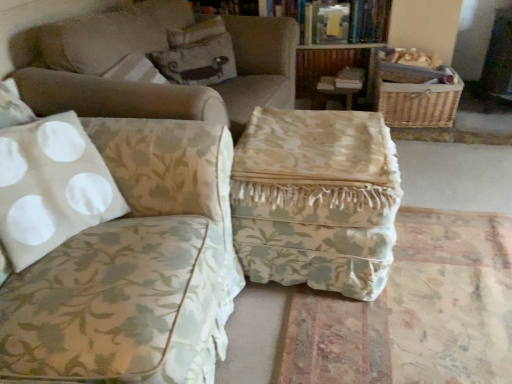
Question: Are floral fabric ottoman at center, which is the first studio couch from back to front, and floral fabric ottoman at center beside each other?

Choices:
 (A) no
 (B) yes

Answer: (A)

Question: Does floral fabric ottoman at center, which is counted as the second studio couch, starting from the front, have a larger size compared to floral fabric ottoman at center?

Choices:
 (A) no
 (B) yes

Answer: (B)

Question: Is floral fabric ottoman at center, which is counted as the second studio couch, starting from the front, looking in the opposite direction of floral fabric ottoman at center?

Choices:
 (A) no
 (B) yes

Answer: (A)

Question: Does floral fabric ottoman at center, which is the first studio couch from back to front, contain floral fabric ottoman at center?

Choices:
 (A) yes
 (B) no

Answer: (B)

Question: Does floral fabric ottoman at center, which is counted as the second studio couch, starting from the front, have a smaller size compared to floral fabric ottoman at center?

Choices:
 (A) yes
 (B) no

Answer: (B)

Question: From the image's perspective, relative to floral fabric pillow at upper center, is woven brown basket at upper right above or below?

Choices:
 (A) below
 (B) above

Answer: (A)

Question: From a real-world perspective, is woven brown basket at upper right physically located above or below floral fabric pillow at upper center?

Choices:
 (A) above
 (B) below

Answer: (B)

Question: Looking at their shapes, would you say woven brown basket at upper right is wider or thinner than floral fabric pillow at upper center?

Choices:
 (A) wide
 (B) thin

Answer: (A)

Question: Based on their sizes in the image, would you say woven brown basket at upper right is bigger or smaller than floral fabric pillow at upper center?

Choices:
 (A) small
 (B) big

Answer: (B)

Question: Considering the positions of floral fabric ottoman at center and hardcover book at upper center in the image, is floral fabric ottoman at center bigger or smaller than hardcover book at upper center?

Choices:
 (A) small
 (B) big

Answer: (B)

Question: Is floral fabric ottoman at center wider or thinner than hardcover book at upper center?

Choices:
 (A) thin
 (B) wide

Answer: (B)

Question: Is floral fabric ottoman at center situated inside hardcover book at upper center or outside?

Choices:
 (A) inside
 (B) outside

Answer: (B)

Question: From the image's perspective, relative to hardcover book at upper center, is floral fabric ottoman at center above or below?

Choices:
 (A) above
 (B) below

Answer: (B)

Question: Considering the positions of point (380, 3) and point (254, 228), is point (380, 3) closer or farther from the camera than point (254, 228)?

Choices:
 (A) closer
 (B) farther

Answer: (B)

Question: Considering the positions of hardcover book at upper center and floral fabric ottoman at center in the image, is hardcover book at upper center wider or thinner than floral fabric ottoman at center?

Choices:
 (A) wide
 (B) thin

Answer: (B)